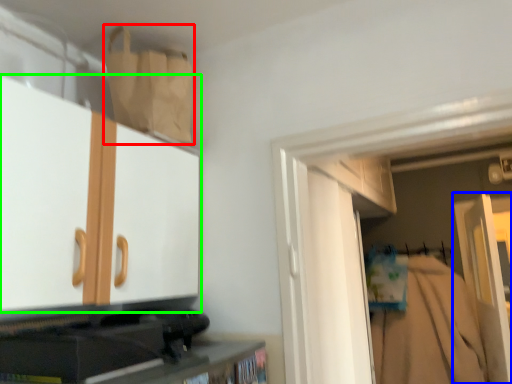
Question: Based on their relative distances, which object is nearer to paper bag (highlighted by a red box)? Choose from door (highlighted by a blue box) and cabinetry (highlighted by a green box).

Choices:
 (A) door
 (B) cabinetry

Answer: (B)